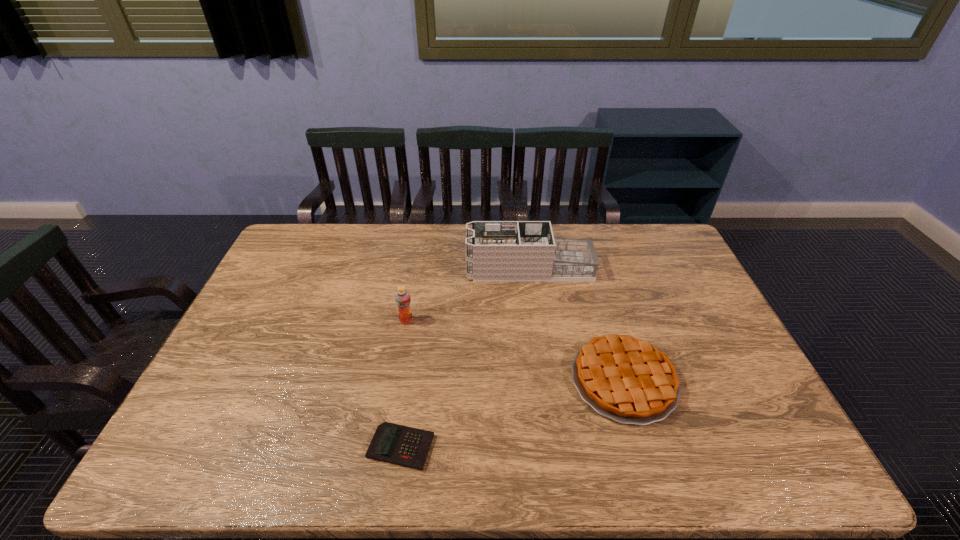
Image resolution: width=960 pixels, height=540 pixels. In order to click on object positioned at the far edge in this screenshot , I will do `click(496, 251)`.

Identify the location of object that is at the near edge. (401, 445).

Image resolution: width=960 pixels, height=540 pixels. Find the location of `free space at the far edge of the desktop`. free space at the far edge of the desktop is located at coordinates (398, 225).

You are a GUI agent. You are given a task and a screenshot of the screen. Output one action in this format:
    pyautogui.click(x=<x>, y=<y>)
    Task: Click on the free space at the left edge
    Image resolution: width=960 pixels, height=540 pixels.
    Given the screenshot: What is the action you would take?
    pyautogui.click(x=197, y=403)

Locate an element on the screen. This screenshot has height=540, width=960. free space at the right edge is located at coordinates (682, 340).

This screenshot has width=960, height=540. In the image, there is a desktop. Find the location of `free space at the far left corner`. free space at the far left corner is located at coordinates (328, 243).

The width and height of the screenshot is (960, 540). I want to click on free region at the far right corner of the desktop, so click(644, 257).

You are a GUI agent. You are given a task and a screenshot of the screen. Output one action in this format:
    pyautogui.click(x=<x>, y=<y>)
    Task: Click on the empty location between the farthest object and the second farthest object
    The height and width of the screenshot is (540, 960).
    Given the screenshot: What is the action you would take?
    pyautogui.click(x=468, y=295)

Image resolution: width=960 pixels, height=540 pixels. I want to click on empty location between the second shortest object and the dollhouse, so click(577, 325).

Identify the location of vacant area between the pie and the calculator. (513, 414).